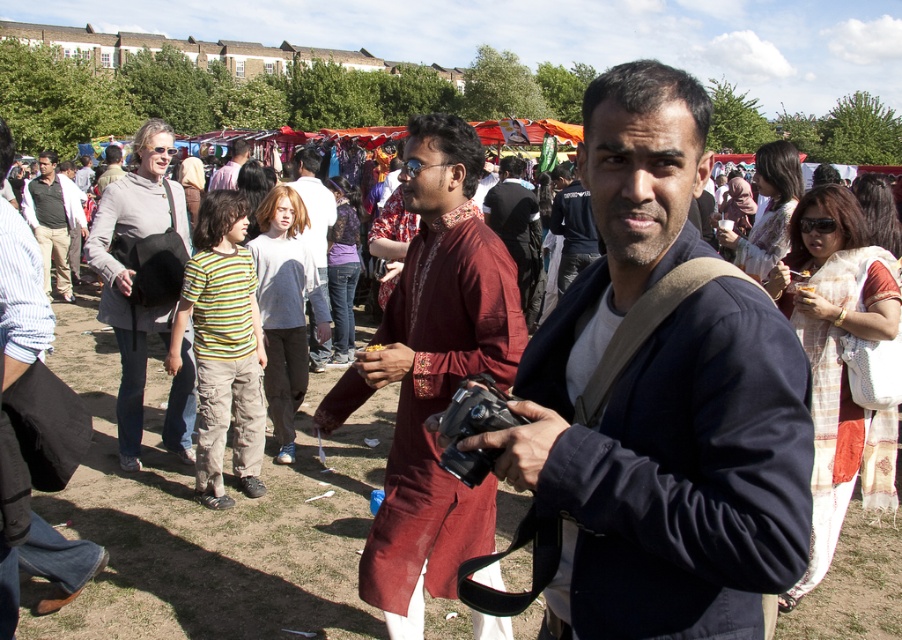
Question: Among these points, which one is farthest from the camera?

Choices:
 (A) (452, 504)
 (B) (569, 449)

Answer: (A)

Question: Can you confirm if dark blue jacket at center is smaller than matte black jacket at left?

Choices:
 (A) no
 (B) yes

Answer: (A)

Question: Considering the real-world distances, which object is farthest from the dark blue jacket at center?

Choices:
 (A) black plastic camera at center
 (B) matte black jacket at left
 (C) maroon fabric kurta at center

Answer: (B)

Question: Considering the relative positions of black plastic camera at center and matte black jacket at left in the image provided, where is black plastic camera at center located with respect to matte black jacket at left?

Choices:
 (A) below
 (B) above

Answer: (A)

Question: Which of the following is the farthest from the observer?

Choices:
 (A) (443, 435)
 (B) (572, 424)

Answer: (A)

Question: Does dark blue jacket at center have a smaller size compared to matte black jacket at left?

Choices:
 (A) no
 (B) yes

Answer: (A)